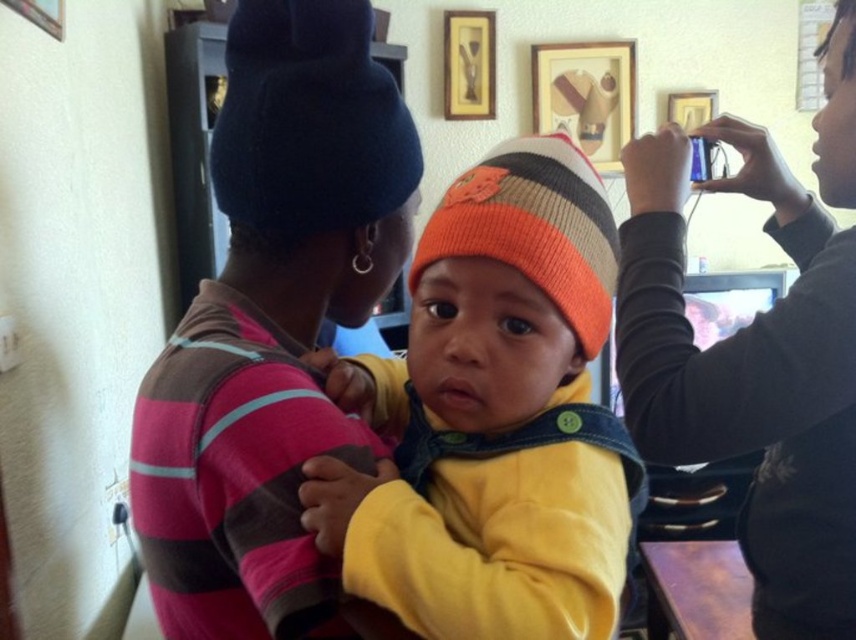
You are standing at point (593, 332) and want to move to point (370, 122). Is the path clear of any obstacles between these two points?

Point (370, 122) is behind point (593, 332), so the path between them is blocked by point (593, 332) itself.

You are a photographer trying to capture a closeup of the knitted orange beanie at center. If your camera can focus on objects within 50 centimeters, will the beanie be in focus?

The knitted orange beanie at center is 50.74 centimeters from the camera, which is slightly beyond the 50 centimeter focus range. Therefore, the beanie will not be in focus.